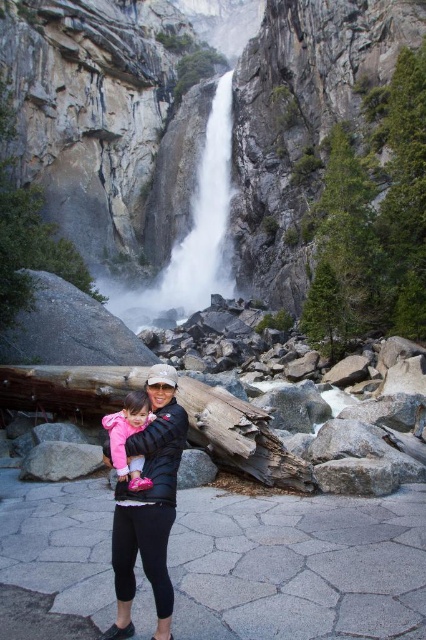
Question: Can you confirm if matte black jacket at center is positioned to the right of pink fabric dress at center?

Choices:
 (A) yes
 (B) no

Answer: (A)

Question: Which of these objects is positioned farthest from the matte black jacket at center?

Choices:
 (A) white frothy water at center
 (B) pink fabric dress at center

Answer: (A)

Question: Does matte black jacket at center have a smaller size compared to white frothy water at center?

Choices:
 (A) yes
 (B) no

Answer: (A)

Question: Which point is farther to the camera?

Choices:
 (A) (123, 445)
 (B) (161, 412)

Answer: (B)

Question: Is matte black jacket at center behind pink fabric dress at center?

Choices:
 (A) yes
 (B) no

Answer: (B)

Question: Which object is farther from the camera taking this photo?

Choices:
 (A) white frothy water at center
 (B) matte black jacket at center

Answer: (A)